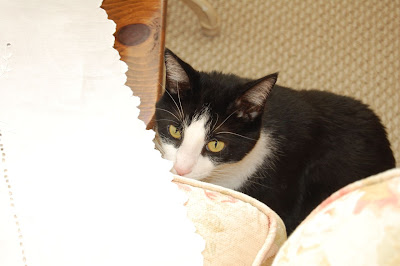
Locate an element on the screen. table is located at coordinates (139, 48).